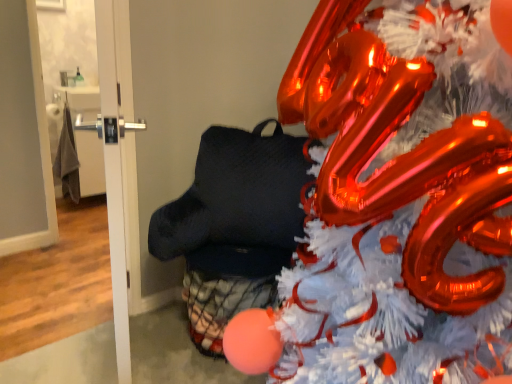
Question: Considering the relative positions of shiny metallic christmas tree at center and white glossy door at left, acting as the 1th door starting from the right, in the image provided, is shiny metallic christmas tree at center in front of white glossy door at left, acting as the 1th door starting from the right,?

Choices:
 (A) yes
 (B) no

Answer: (A)

Question: Considering the relative sizes of shiny metallic christmas tree at center and white glossy door at left, acting as the 1th door starting from the right, in the image provided, is shiny metallic christmas tree at center taller than white glossy door at left, acting as the 1th door starting from the right,?

Choices:
 (A) yes
 (B) no

Answer: (A)

Question: Can you confirm if shiny metallic christmas tree at center is smaller than white glossy door at left, acting as the 1th door starting from the right?

Choices:
 (A) yes
 (B) no

Answer: (B)

Question: Considering the relative positions of shiny metallic christmas tree at center and white glossy door at left, placed as the 2th door when sorted from left to right, in the image provided, is shiny metallic christmas tree at center behind white glossy door at left, placed as the 2th door when sorted from left to right,?

Choices:
 (A) no
 (B) yes

Answer: (A)

Question: From the image's perspective, is shiny metallic christmas tree at center under white glossy door at left, acting as the 1th door starting from the right?

Choices:
 (A) no
 (B) yes

Answer: (B)

Question: Is white glossy door at left, placed as the 2th door when sorted from left to right, to the left or to the right of shiny metallic christmas tree at center in the image?

Choices:
 (A) left
 (B) right

Answer: (A)

Question: In terms of size, does white glossy door at left, acting as the 1th door starting from the right, appear bigger or smaller than shiny metallic christmas tree at center?

Choices:
 (A) small
 (B) big

Answer: (A)

Question: Does point (136, 183) appear closer or farther from the camera than point (479, 345)?

Choices:
 (A) closer
 (B) farther

Answer: (B)

Question: From a real-world perspective, is white glossy door at left, placed as the 2th door when sorted from left to right, above or below shiny metallic christmas tree at center?

Choices:
 (A) above
 (B) below

Answer: (B)

Question: In terms of size, does white glossy door at upper left, arranged as the second door when viewed from the right, appear bigger or smaller than white glossy door at left, acting as the 1th door starting from the right?

Choices:
 (A) big
 (B) small

Answer: (B)

Question: Would you say white glossy door at upper left, arranged as the second door when viewed from the right, is to the left or to the right of white glossy door at left, placed as the 2th door when sorted from left to right, in the picture?

Choices:
 (A) right
 (B) left

Answer: (B)

Question: Would you say white glossy door at upper left, arranged as the second door when viewed from the right, is inside or outside white glossy door at left, placed as the 2th door when sorted from left to right?

Choices:
 (A) inside
 (B) outside

Answer: (B)

Question: Does point [123, 276] appear closer or farther from the camera than point [105, 173]?

Choices:
 (A) closer
 (B) farther

Answer: (B)

Question: From their relative heights in the image, would you say white glossy door at left, placed as the 2th door when sorted from left to right, is taller or shorter than white glossy door at upper left, arranged as the second door when viewed from the right?

Choices:
 (A) tall
 (B) short

Answer: (A)

Question: From a real-world perspective, is white glossy door at left, acting as the 1th door starting from the right, physically located above or below white glossy door at upper left, arranged as the second door when viewed from the right?

Choices:
 (A) below
 (B) above

Answer: (B)